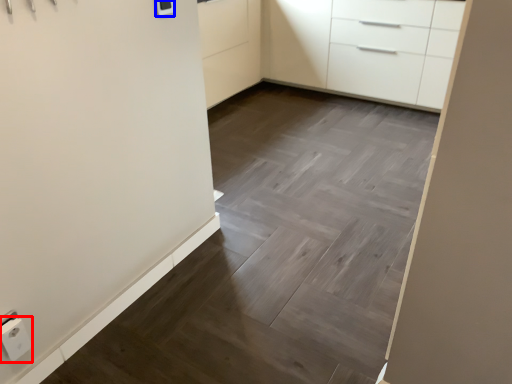
Question: Which of the following is the closest to the observer, electric outlet (highlighted by a red box) or light switch (highlighted by a blue box)?

Choices:
 (A) electric outlet
 (B) light switch

Answer: (A)